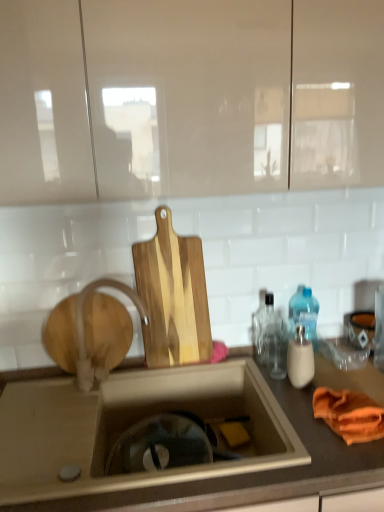
Where is `matte gray countertop at center`? This screenshot has width=384, height=512. matte gray countertop at center is located at coordinates (166, 470).

In order to click on translucent plastic bottle at right, which appears as the 1th bottle when viewed from the back in this screenshot , I will do `click(304, 311)`.

Describe the element at coordinates (83, 329) in the screenshot. The height and width of the screenshot is (512, 384). I see `white matte faucet at center` at that location.

The width and height of the screenshot is (384, 512). What do you see at coordinates (300, 359) in the screenshot?
I see `translucent glass bottle at right, positioned as the third bottle in back-to-front order` at bounding box center [300, 359].

The height and width of the screenshot is (512, 384). Describe the element at coordinates (173, 296) in the screenshot. I see `natural wood cutting board at center` at that location.

Image resolution: width=384 pixels, height=512 pixels. What are the coordinates of `transparent glass bottle at right, which is the 2th bottle in back-to-front order` in the screenshot? It's located at (267, 333).

Considering the sizes of objects orange cloth at right and translucent glass bottle at right, positioned as the third bottle in back-to-front order, in the image provided, who is thinner, orange cloth at right or translucent glass bottle at right, positioned as the third bottle in back-to-front order,?

With smaller width is translucent glass bottle at right, positioned as the third bottle in back-to-front order.

Consider the image. From the image's perspective, is orange cloth at right under translucent glass bottle at right, positioned as the third bottle in back-to-front order?

Yes, from the image's perspective, orange cloth at right is beneath translucent glass bottle at right, positioned as the third bottle in back-to-front order.

In the scene shown: From a real-world perspective, is orange cloth at right on translucent glass bottle at right, positioned as the third bottle in back-to-front order?

No, from a real-world perspective, orange cloth at right is not above translucent glass bottle at right, positioned as the third bottle in back-to-front order.

Identify the location of cutting board that is above the matte gray countertop at center (from the image's perspective). This screenshot has width=384, height=512. (173, 296).

Is natural wood cutting board at center thinner than matte gray countertop at center?

Result: Yes, natural wood cutting board at center is thinner than matte gray countertop at center.

Are natural wood cutting board at center and matte gray countertop at center far apart?

No, natural wood cutting board at center is in close proximity to matte gray countertop at center.

How different are the orientations of natural wood cutting board at center and matte gray countertop at center in degrees?

The angular difference between natural wood cutting board at center and matte gray countertop at center is 0.0017 degrees.

Can you confirm if transparent glass bottle at right, which ranks as the second bottle in front-to-back order, is bigger than orange cloth at right?

Yes, transparent glass bottle at right, which ranks as the second bottle in front-to-back order, is bigger than orange cloth at right.

In the scene shown: In terms of width, does transparent glass bottle at right, which is the 2th bottle in back-to-front order, look wider or thinner when compared to orange cloth at right?

Clearly, transparent glass bottle at right, which is the 2th bottle in back-to-front order, has less width compared to orange cloth at right.

From the image's perspective, which object appears higher, transparent glass bottle at right, which is the 2th bottle in back-to-front order, or orange cloth at right?

transparent glass bottle at right, which is the 2th bottle in back-to-front order, from the image's perspective.

In the image, is transparent glass bottle at right, which ranks as the second bottle in front-to-back order, on the left side or the right side of orange cloth at right?

Based on their positions, transparent glass bottle at right, which ranks as the second bottle in front-to-back order, is located to the left of orange cloth at right.

Considering the sizes of objects orange cloth at right and wooden at left in the image provided, who is thinner, orange cloth at right or wooden at left?

wooden at left is thinner.

Consider the image. Does orange cloth at right have a larger size compared to wooden at left?

Actually, orange cloth at right might be smaller than wooden at left.

Could you tell me if orange cloth at right is facing wooden at left?

No.

Does point (334, 420) appear closer or farther from the camera than point (104, 323)?

Point (334, 420) appears to be closer to the viewer than point (104, 323).

Considering the relative sizes of translucent glass bottle at right, positioned as the third bottle in back-to-front order, and orange cloth at right in the image provided, is translucent glass bottle at right, positioned as the third bottle in back-to-front order, thinner than orange cloth at right?

Indeed, translucent glass bottle at right, positioned as the third bottle in back-to-front order, has a lesser width compared to orange cloth at right.

Considering the sizes of objects translucent glass bottle at right, positioned as the third bottle in back-to-front order, and orange cloth at right in the image provided, who is taller, translucent glass bottle at right, positioned as the third bottle in back-to-front order, or orange cloth at right?

Standing taller between the two is translucent glass bottle at right, positioned as the third bottle in back-to-front order.

From the image's perspective, which one is positioned lower, translucent glass bottle at right, positioned as the third bottle in back-to-front order, or orange cloth at right?

orange cloth at right appears lower in the image.

Is translucent glass bottle at right, positioned as the third bottle in back-to-front order, closer to the viewer compared to orange cloth at right?

No, the depth of translucent glass bottle at right, positioned as the third bottle in back-to-front order, is greater than that of orange cloth at right.

Looking at the image, does orange cloth at right seem bigger or smaller compared to natural wood cutting board at center?

Clearly, orange cloth at right is smaller in size than natural wood cutting board at center.

From a real-world perspective, which is physically below, orange cloth at right or natural wood cutting board at center?

orange cloth at right.

From the image's perspective, is orange cloth at right above or below natural wood cutting board at center?

orange cloth at right is situated lower than natural wood cutting board at center in the image.

From a real-world perspective, which object rests below the other?

In real-world perspective, transparent glass bottle at right, which ranks as the second bottle in front-to-back order, is lower.

Which of these two, transparent glass bottle at right, which is the 2th bottle in back-to-front order, or wooden at left, stands taller?

Standing taller between the two is wooden at left.

Considering the relative sizes of transparent glass bottle at right, which is the 2th bottle in back-to-front order, and wooden at left in the image provided, is transparent glass bottle at right, which is the 2th bottle in back-to-front order, smaller than wooden at left?

Yes.

How far apart are transparent glass bottle at right, which is the 2th bottle in back-to-front order, and wooden at left?

transparent glass bottle at right, which is the 2th bottle in back-to-front order, is 20.60 inches away from wooden at left.

I want to click on the 1st bottle located above the orange cloth at right (from a real-world perspective), so click(300, 359).

The image size is (384, 512). I want to click on countertop in front of the natural wood cutting board at center, so pyautogui.click(x=166, y=470).

Considering their positions, is white matte faucet at center positioned further to orange cloth at right than matte gray countertop at center?

Based on the image, white matte faucet at center appears to be further to orange cloth at right.

From the image, which object appears to be nearer to natural wood cutting board at center, white matte faucet at center or transparent glass bottle at right, which is the 2th bottle in back-to-front order?

The object closer to natural wood cutting board at center is white matte faucet at center.

Estimate the real-world distances between objects in this image. Which object is further from matte gray countertop at center, white matte faucet at center or translucent glass bottle at right, positioned as the third bottle in back-to-front order?

translucent glass bottle at right, positioned as the third bottle in back-to-front order, lies further to matte gray countertop at center than the other object.

When comparing their distances from natural wood cutting board at center, does transparent glass bottle at right, which is the 2th bottle in back-to-front order, or orange cloth at right seem closer?

transparent glass bottle at right, which is the 2th bottle in back-to-front order, is positioned closer to the anchor natural wood cutting board at center.

When comparing their distances from wooden at left, does white matte faucet at center or orange cloth at right seem further?

orange cloth at right is further to wooden at left.

Estimate the real-world distances between objects in this image. Which object is further from wooden at left, translucent plastic bottle at right, which ranks as the third bottle in front-to-back order, or natural wood cutting board at center?

The object further to wooden at left is translucent plastic bottle at right, which ranks as the third bottle in front-to-back order.

When comparing their distances from transparent glass bottle at right, which ranks as the second bottle in front-to-back order, does matte gray countertop at center or natural wood cutting board at center seem further?

The object further to transparent glass bottle at right, which ranks as the second bottle in front-to-back order, is matte gray countertop at center.

Considering their positions, is matte gray countertop at center positioned further to white matte faucet at center than natural wood cutting board at center?

matte gray countertop at center lies further to white matte faucet at center than the other object.

I want to click on cutting board located between white matte faucet at center and transparent glass bottle at right, which is the 2th bottle in back-to-front order, in the left-right direction, so click(x=173, y=296).

I want to click on material situated between wooden at left and translucent plastic bottle at right, which ranks as the third bottle in front-to-back order, from left to right, so click(x=349, y=414).

Locate an element on the screen. material situated between natural wood cutting board at center and translucent plastic bottle at right, which ranks as the third bottle in front-to-back order, from left to right is located at coordinates (349, 414).

Find the location of a particular element. The image size is (384, 512). cutting board located between white matte faucet at center and translucent glass bottle at right, which is the first bottle from front to back, in the left-right direction is located at coordinates tap(173, 296).